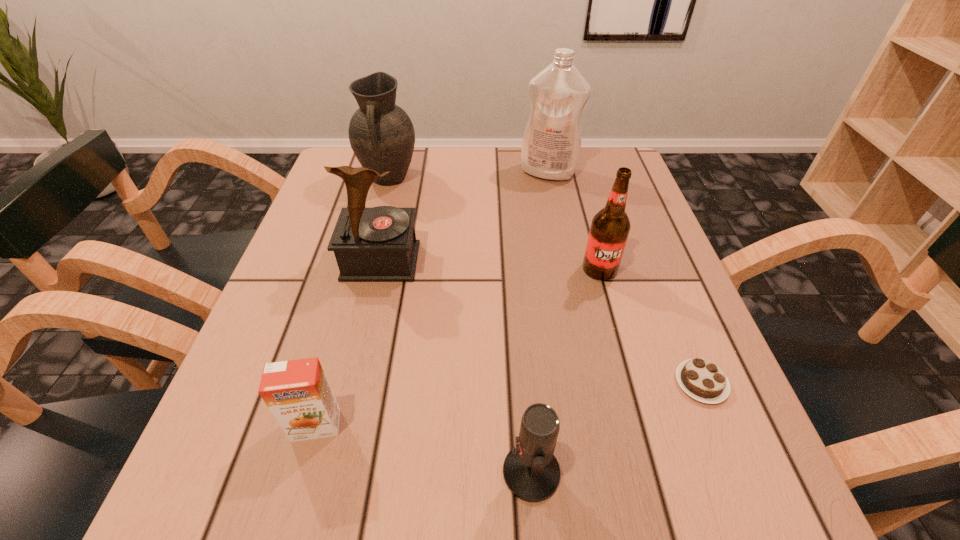
Identify the location of free space at the left edge of the desktop. (356, 284).

Find the location of `vacant space at the right edge`. vacant space at the right edge is located at coordinates (690, 416).

This screenshot has height=540, width=960. I want to click on free space at the far left corner of the desktop, so pyautogui.click(x=324, y=189).

This screenshot has width=960, height=540. What are the coordinates of `vacant area at the far right corner of the desktop` in the screenshot? It's located at (622, 151).

The width and height of the screenshot is (960, 540). In the image, there is a desktop. In order to click on free space at the near right corner in this screenshot , I will do `click(662, 491)`.

At what (x,y) coordinates should I click in order to perform the action: click on unoccupied position between the root beer and the third nearest object. Please return your answer as a coordinate pair (x, y). Image resolution: width=960 pixels, height=540 pixels. Looking at the image, I should click on (651, 326).

Where is `free point between the orange juice and the phonograph_record`? Image resolution: width=960 pixels, height=540 pixels. free point between the orange juice and the phonograph_record is located at coordinates (348, 343).

Image resolution: width=960 pixels, height=540 pixels. In order to click on empty space between the phonograph_record and the root beer in this screenshot , I will do `click(491, 265)`.

Locate an element on the screen. free area in between the rightmost object and the orange juice is located at coordinates [x=509, y=404].

Where is `free space between the microphone and the sixth farthest object`? The width and height of the screenshot is (960, 540). free space between the microphone and the sixth farthest object is located at coordinates (423, 449).